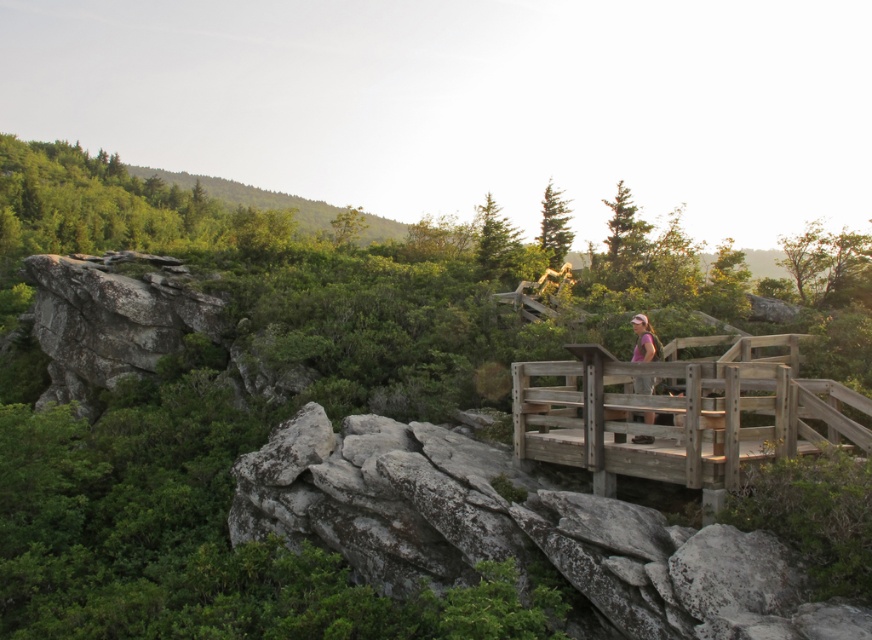
Question: Is the position of wooden bridge at center less distant than that of pink fabric at center-right?

Choices:
 (A) no
 (B) yes

Answer: (B)

Question: Which point appears closest to the camera in this image?

Choices:
 (A) (603, 412)
 (B) (645, 358)

Answer: (A)

Question: Among these points, which one is nearest to the camera?

Choices:
 (A) (669, 360)
 (B) (657, 353)

Answer: (B)

Question: Can you confirm if wooden bridge at center is wider than pink fabric at center-right?

Choices:
 (A) yes
 (B) no

Answer: (A)

Question: Can you confirm if wooden bridge at center is positioned to the right of pink fabric at center-right?

Choices:
 (A) no
 (B) yes

Answer: (A)